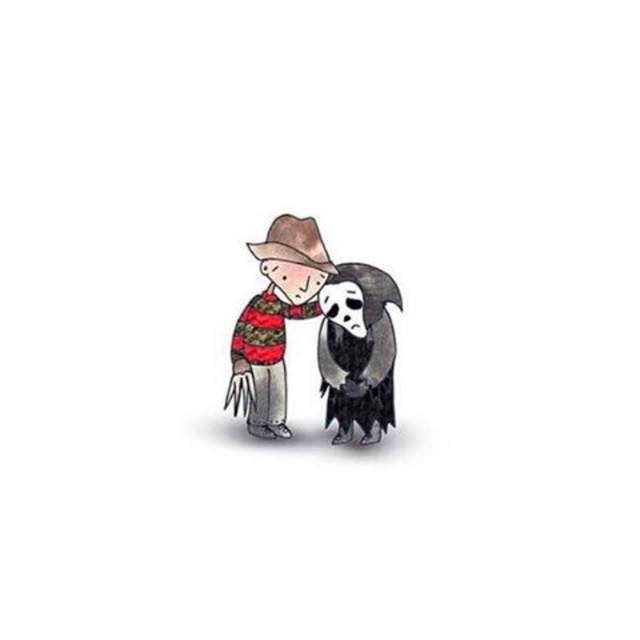
Question: Does striped sweater at center appear under black matte ghost at lower right?

Choices:
 (A) yes
 (B) no

Answer: (B)

Question: Considering the relative positions of striped sweater at center and brown felt cowboy hat at upper center in the image provided, where is striped sweater at center located with respect to brown felt cowboy hat at upper center?

Choices:
 (A) right
 (B) left

Answer: (B)

Question: Which point is closer to the camera taking this photo?

Choices:
 (A) coord(276,234)
 (B) coord(269,349)

Answer: (A)

Question: Which object is positioned closest to the striped sweater at center?

Choices:
 (A) black matte ghost at lower right
 (B) brown felt cowboy hat at upper center

Answer: (B)

Question: Is striped sweater at center wider than black matte ghost at lower right?

Choices:
 (A) no
 (B) yes

Answer: (B)

Question: Which is nearer to the black matte ghost at lower right?

Choices:
 (A) brown felt cowboy hat at upper center
 (B) striped sweater at center

Answer: (B)